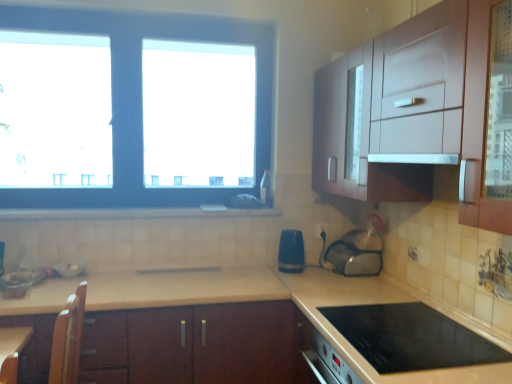
This screenshot has width=512, height=384. I want to click on empty space that is ontop of white tile at lower center (from a real-world perspective), so click(x=140, y=206).